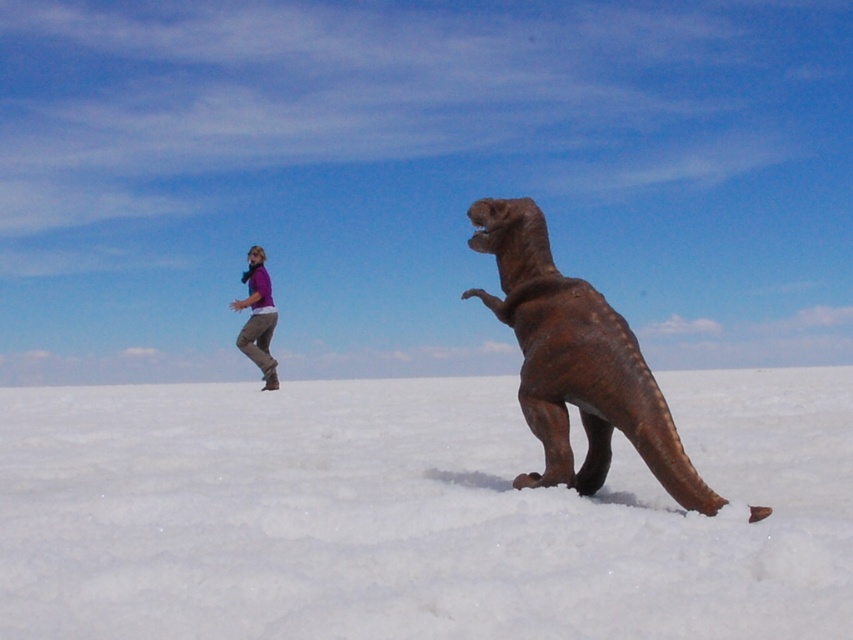
Question: Does rusty metal dinosaur at center have a larger size compared to purple fabric shirt at upper left?

Choices:
 (A) yes
 (B) no

Answer: (A)

Question: Which of these objects is positioned closest to the purple fabric shirt at upper left?

Choices:
 (A) white fluffy snow at center
 (B) rusty metal dinosaur at center

Answer: (A)

Question: Is white fluffy snow at center thinner than rusty metal dinosaur at center?

Choices:
 (A) yes
 (B) no

Answer: (B)

Question: Which of the following is the closest to the observer?

Choices:
 (A) white fluffy snow at center
 (B) purple fabric shirt at upper left

Answer: (A)

Question: Which of the following is the closest to the observer?

Choices:
 (A) (636, 410)
 (B) (74, 621)

Answer: (B)

Question: Is rusty metal dinosaur at center below purple fabric shirt at upper left?

Choices:
 (A) no
 (B) yes

Answer: (B)